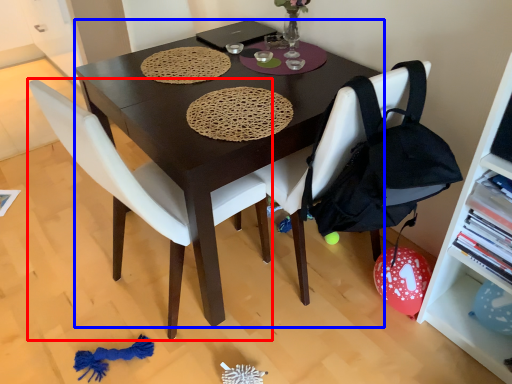
Question: Which object appears farthest to the camera in this image, chair (highlighted by a red box) or desk (highlighted by a blue box)?

Choices:
 (A) chair
 (B) desk

Answer: (B)